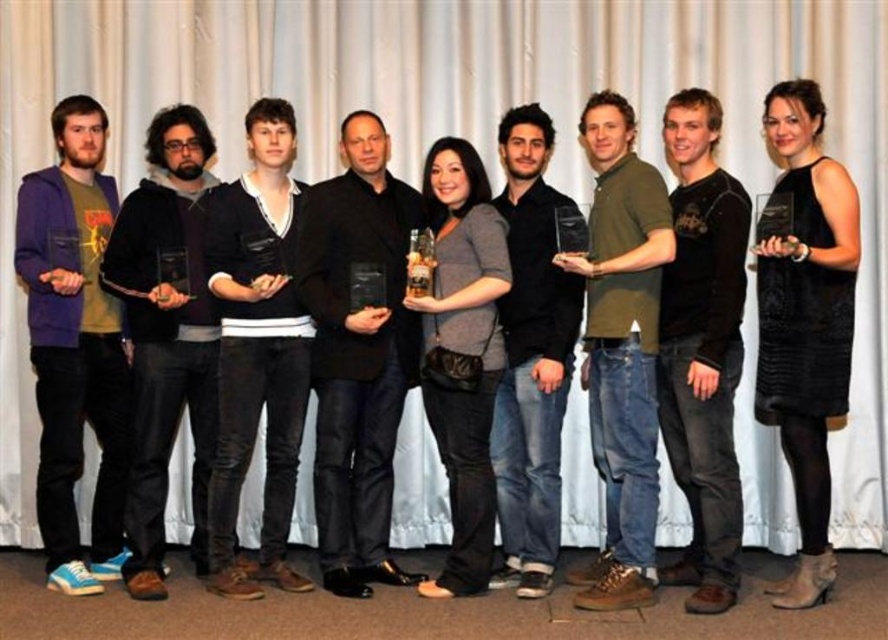
Question: Which of these objects is positioned closest to the purple fleece jacket at left?

Choices:
 (A) matte black hoodie at left
 (B) green matte shirt at center
 (C) dark blue jeans at center

Answer: (A)

Question: Does matte black hoodie at left appear under dark blue jeans at center?

Choices:
 (A) yes
 (B) no

Answer: (B)

Question: Does green matte shirt at center have a lesser width compared to dark blue jeans at center?

Choices:
 (A) yes
 (B) no

Answer: (B)

Question: Among these points, which one is nearest to the camera?

Choices:
 (A) (65, 500)
 (B) (545, 289)

Answer: (B)

Question: Which object is the closest to the black matte shirt at center?

Choices:
 (A) purple fleece jacket at left
 (B) dark blue jeans at center
 (C) black matte jacket at center

Answer: (B)

Question: Can you confirm if matte black hoodie at left is positioned below green matte shirt at center?

Choices:
 (A) yes
 (B) no

Answer: (A)